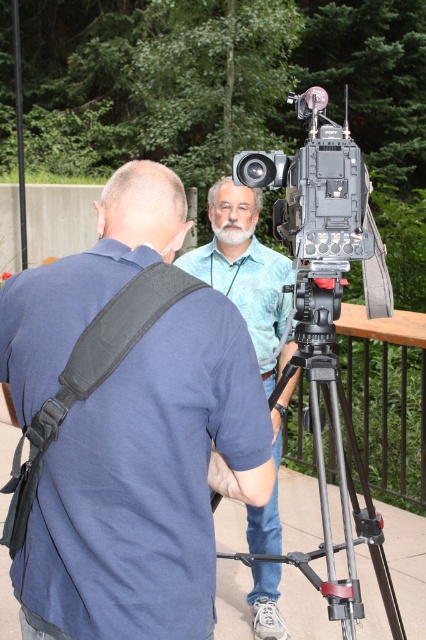
Who is positioned more to the right, black matte video camera at center or blue fabric shirt at center?

Positioned to the right is black matte video camera at center.

Where is `black matte video camera at center`? The width and height of the screenshot is (426, 640). black matte video camera at center is located at coordinates (322, 202).

Does black matte video camera at center have a lesser height compared to black metal tripod at center?

Indeed, black matte video camera at center has a lesser height compared to black metal tripod at center.

Between black matte video camera at center and black metal tripod at center, which one is positioned lower?

black metal tripod at center is lower down.

I want to click on black matte video camera at center, so click(x=322, y=202).

Image resolution: width=426 pixels, height=640 pixels. Identify the location of black matte video camera at center. (322, 202).

Locate an element on the screen. blue cotton shirt at upper left is located at coordinates (147, 484).

Who is taller, blue cotton shirt at upper left or black matte video camera at center?

blue cotton shirt at upper left is taller.

The height and width of the screenshot is (640, 426). I want to click on blue cotton shirt at upper left, so click(147, 484).

At what (x,y) coordinates should I click in order to perform the action: click on blue cotton shirt at upper left. Please return your answer as a coordinate pair (x, y). Looking at the image, I should click on (147, 484).